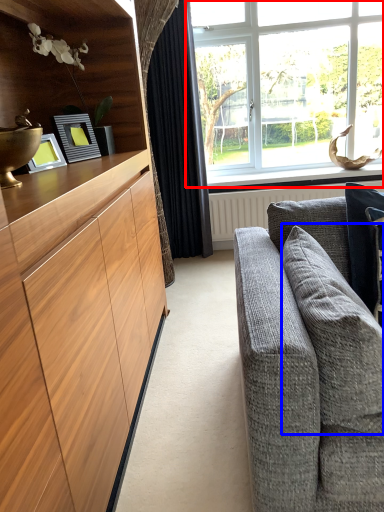
Question: Which object is closer to the camera taking this photo, window (highlighted by a red box) or pillow (highlighted by a blue box)?

Choices:
 (A) window
 (B) pillow

Answer: (B)